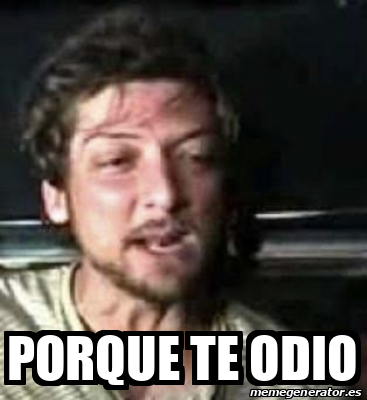
This screenshot has height=400, width=367. In order to click on ledge in this screenshot , I will do `click(308, 243)`.